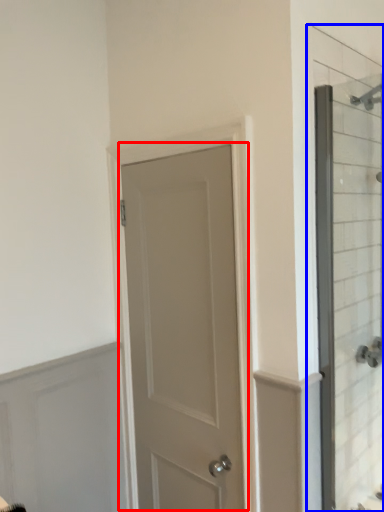
Question: Which point is closer to the camera, door (highlighted by a red box) or glass door (highlighted by a blue box)?

Choices:
 (A) door
 (B) glass door

Answer: (B)